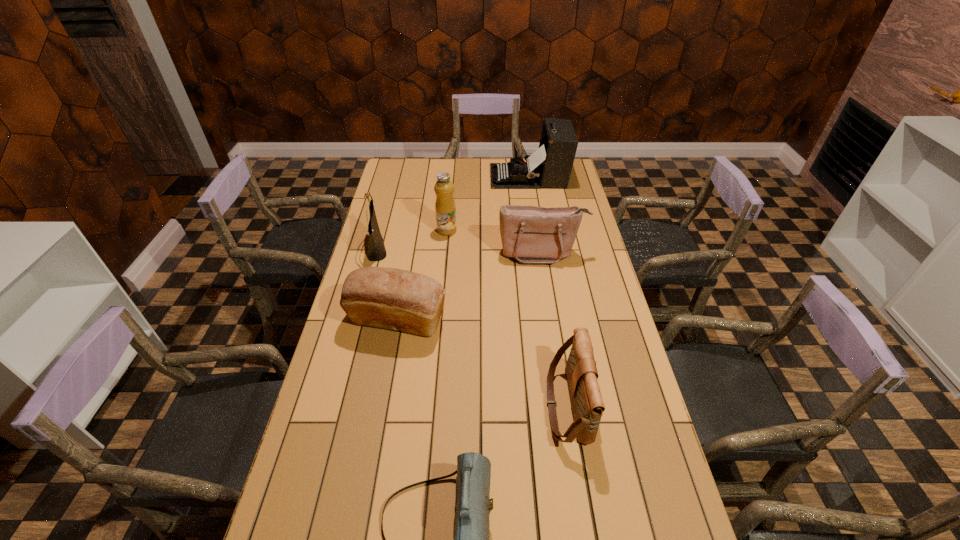
Identify the location of free location located on the back of the bread. (412, 241).

In order to click on vacant space located 0.130m on the front-facing side of the second nearest object in this screenshot , I will do `click(500, 405)`.

The width and height of the screenshot is (960, 540). I want to click on blank area located 0.370m on the front-facing side of the second nearest object, so click(x=414, y=405).

Find the location of `vacant space located 0.330m on the front-facing side of the second nearest object`. vacant space located 0.330m on the front-facing side of the second nearest object is located at coordinates (428, 405).

At what (x,y) coordinates should I click in order to perform the action: click on object positioned at the far edge. Please return your answer as a coordinate pair (x, y). The width and height of the screenshot is (960, 540). Looking at the image, I should click on (550, 166).

Identify the location of shoulder bag that is at the left edge. (376, 251).

Locate an element on the screen. The width and height of the screenshot is (960, 540). bread present at the left edge is located at coordinates (389, 298).

The width and height of the screenshot is (960, 540). Identify the location of typewriter at the right edge. (550, 166).

Locate an element on the screen. This screenshot has width=960, height=540. object located at the far right corner is located at coordinates (550, 166).

Where is `vacant space at the left edge`? vacant space at the left edge is located at coordinates (404, 213).